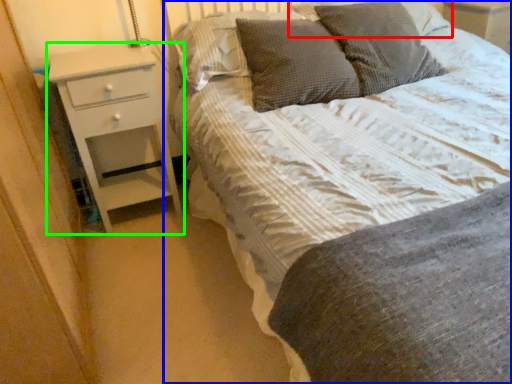
Question: Based on their relative distances, which object is nearer to pillow (highlighted by a red box)? Choose from bed (highlighted by a blue box) and chest of drawers (highlighted by a green box).

Choices:
 (A) bed
 (B) chest of drawers

Answer: (A)